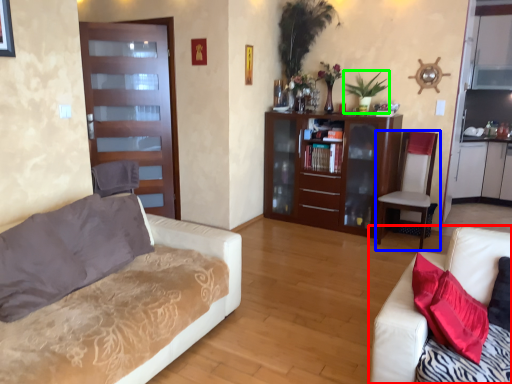
Question: Which object is positioned farthest from studio couch (highlighted by a red box)? Select from chair (highlighted by a blue box) and plant (highlighted by a green box).

Choices:
 (A) chair
 (B) plant

Answer: (B)